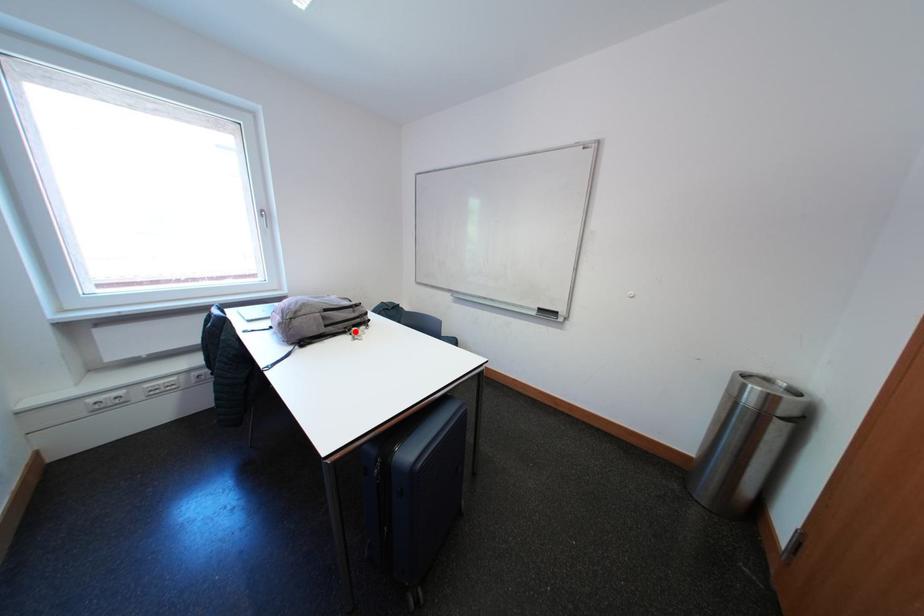
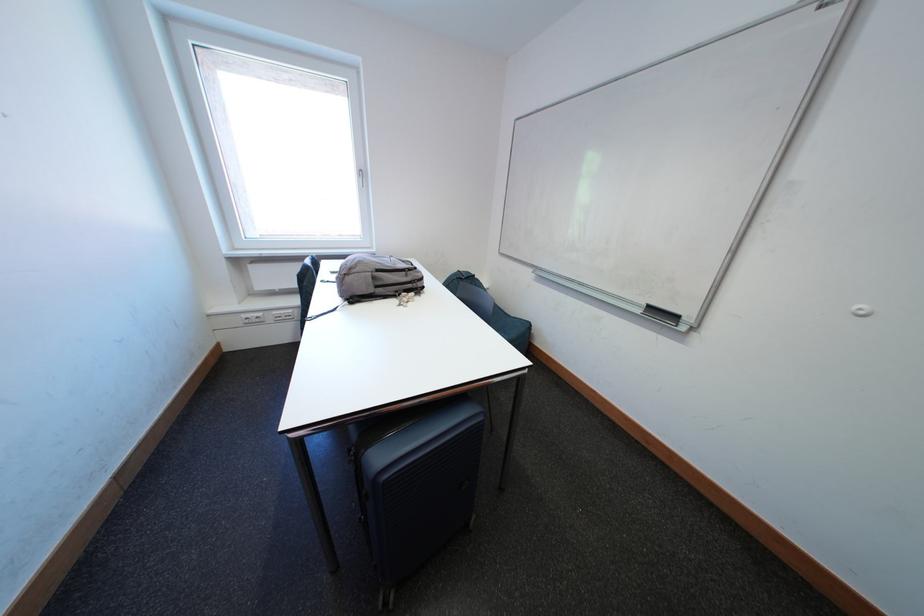
Find the pixel in the second image that matches the highlighted location in the first image.

(406, 294)